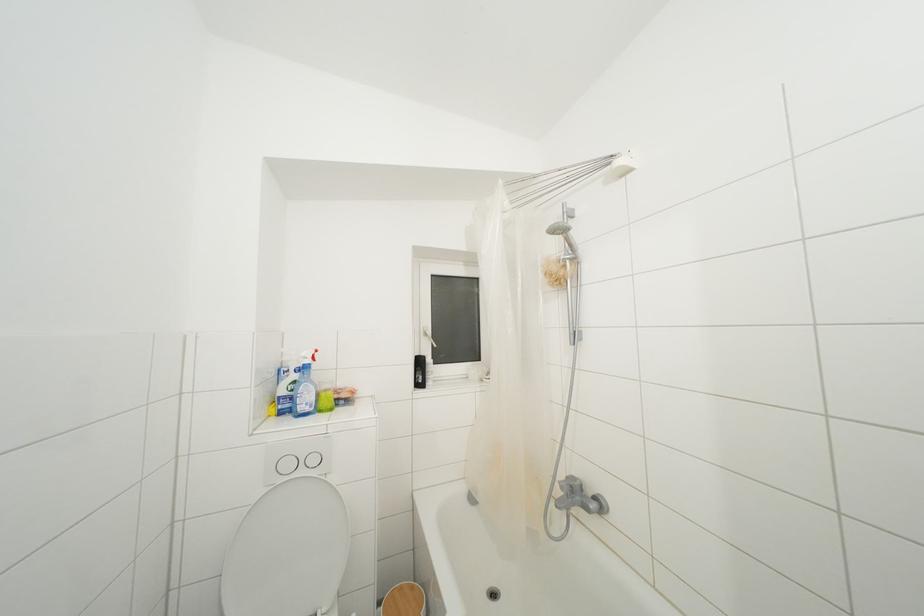
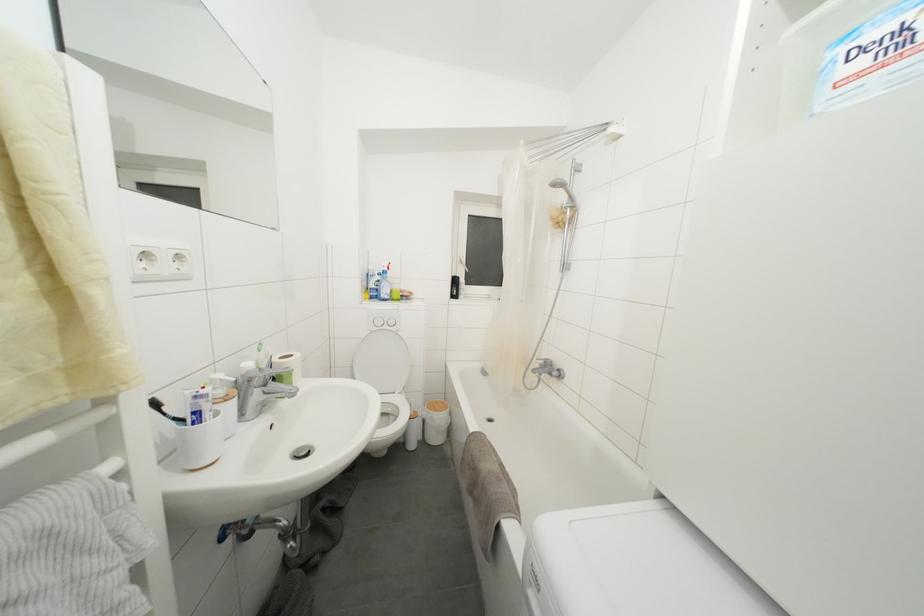
Question: I am providing you with two images of the same scene from different viewpoints. Which of the following objects are not visible in image2?

Choices:
 (A) blue spray bottle
 (B) silver faucet handle
 (C) toothpaste tube
 (D) none of these

Answer: (D)